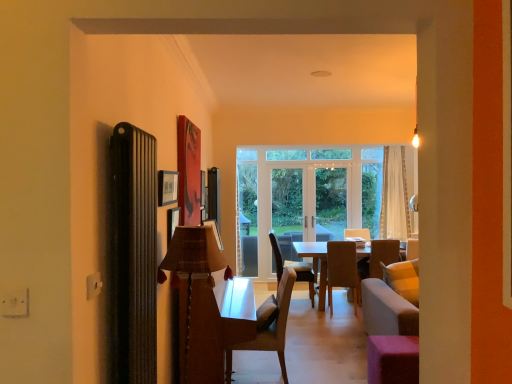
From the picture: What is the approximate height of plaid fabric lampshade at center?

plaid fabric lampshade at center is 1.09 meters tall.

The height and width of the screenshot is (384, 512). Describe the element at coordinates (293, 268) in the screenshot. I see `brown leather chair at center, which ranks as the 3th chair in front-to-back order` at that location.

In order to face pink fabric stool at lower right, should I rotate leftwards or rightwards?

It's best to rotate right around 18.785 degrees.

Measure the distance between pink fabric stool at lower right and camera.

They are 3.02 meters apart.

You are a GUI agent. You are given a task and a screenshot of the screen. Output one action in this format:
    pyautogui.click(x=<x>, y=<y>)
    Task: Click on the plaid fabric lampshade at center
    This screenshot has height=384, width=512.
    Given the screenshot: What is the action you would take?
    pyautogui.click(x=192, y=262)

Between light brown fabric chair at center, which ranks as the 2th chair in front-to-back order, and matte black picture frame at upper left, which one is positioned behind?

light brown fabric chair at center, which ranks as the 2th chair in front-to-back order.

This screenshot has width=512, height=384. What are the coordinates of `picture frame above the light brown fabric chair at center, the 1th chair in the right-to-left sequence (from a real-world perspective)` in the screenshot? It's located at (167, 187).

From the picture: Is light brown fabric chair at center, the 1th chair in the right-to-left sequence, bigger than matte black picture frame at upper left?

Correct, light brown fabric chair at center, the 1th chair in the right-to-left sequence, is larger in size than matte black picture frame at upper left.

How far apart are light brown fabric chair at center, the 1th chair in the right-to-left sequence, and matte black picture frame at upper left?

light brown fabric chair at center, the 1th chair in the right-to-left sequence, is 4.03 meters away from matte black picture frame at upper left.

Considering the relative sizes of clear glass door at center, arranged as the 1th screen door when viewed from the right, and light brown fabric chair at center, which ranks as the 2th chair in front-to-back order, in the image provided, is clear glass door at center, arranged as the 1th screen door when viewed from the right, smaller than light brown fabric chair at center, which ranks as the 2th chair in front-to-back order,?

Actually, clear glass door at center, arranged as the 1th screen door when viewed from the right, might be larger than light brown fabric chair at center, which ranks as the 2th chair in front-to-back order.

From the image's perspective, is clear glass door at center, the second screen door when ordered from left to right, under light brown fabric chair at center, the 1th chair in the right-to-left sequence?

Incorrect, from the image's perspective, clear glass door at center, the second screen door when ordered from left to right, is higher than light brown fabric chair at center, the 1th chair in the right-to-left sequence.

Considering the relative sizes of clear glass door at center, arranged as the 1th screen door when viewed from the right, and light brown fabric chair at center, the 1th chair in the right-to-left sequence, in the image provided, is clear glass door at center, arranged as the 1th screen door when viewed from the right, thinner than light brown fabric chair at center, the 1th chair in the right-to-left sequence,?

Indeed, clear glass door at center, arranged as the 1th screen door when viewed from the right, has a lesser width compared to light brown fabric chair at center, the 1th chair in the right-to-left sequence.

Does clear glass door at center, arranged as the 1th screen door when viewed from the right, contain light brown fabric chair at center, which ranks as the 2th chair in front-to-back order?

Definitely not — light brown fabric chair at center, which ranks as the 2th chair in front-to-back order, is not inside clear glass door at center, arranged as the 1th screen door when viewed from the right.

Relative to brown leather chair at center, arranged as the 1th chair when viewed from the back, is white glossy screen door at center, positioned as the first screen door in left-to-right order, in front or behind?

Clearly, white glossy screen door at center, positioned as the first screen door in left-to-right order, is behind brown leather chair at center, arranged as the 1th chair when viewed from the back.

Does white glossy screen door at center, positioned as the first screen door in left-to-right order, have a lesser width compared to brown leather chair at center, positioned as the second chair in left-to-right order?

Yes.

Is point (272, 227) closer to viewer compared to point (300, 263)?

No.

Is white glossy screen door at center, the 2th screen door viewed from the right, facing towards brown leather chair at center, which ranks as the 3th chair in front-to-back order?

Yes, white glossy screen door at center, the 2th screen door viewed from the right, is turned towards brown leather chair at center, which ranks as the 3th chair in front-to-back order.

Is light brown wooden chair at center, which appears as the 3th chair when viewed from the back, positioned beyond the bounds of pink fabric stool at lower right?

Yes, light brown wooden chair at center, which appears as the 3th chair when viewed from the back, is located beyond the bounds of pink fabric stool at lower right.

From the image's perspective, is light brown wooden chair at center, positioned as the 1th chair in left-to-right order, located above or below pink fabric stool at lower right?

From the image's perspective, light brown wooden chair at center, positioned as the 1th chair in left-to-right order, appears above pink fabric stool at lower right.

Who is bigger, light brown wooden chair at center, which is the 3th chair from right to left, or pink fabric stool at lower right?

Bigger between the two is light brown wooden chair at center, which is the 3th chair from right to left.

Can you confirm if light brown wooden chair at center, which is the 3th chair from right to left, is thinner than pink fabric stool at lower right?

In fact, light brown wooden chair at center, which is the 3th chair from right to left, might be wider than pink fabric stool at lower right.

Which is more to the left, pink fabric stool at lower right or clear glass door at center, the second screen door when ordered from left to right?

Positioned to the left is clear glass door at center, the second screen door when ordered from left to right.

Is pink fabric stool at lower right aimed at clear glass door at center, the second screen door when ordered from left to right?

No, pink fabric stool at lower right is not aimed at clear glass door at center, the second screen door when ordered from left to right.

Considering the sizes of pink fabric stool at lower right and clear glass door at center, arranged as the 1th screen door when viewed from the right, in the image, is pink fabric stool at lower right wider or thinner than clear glass door at center, arranged as the 1th screen door when viewed from the right,?

Considering their sizes, pink fabric stool at lower right looks broader than clear glass door at center, arranged as the 1th screen door when viewed from the right.

Which is in front, white sheer curtain at center or clear glass door at center, arranged as the 1th screen door when viewed from the right?

Positioned in front is white sheer curtain at center.

From a real-world perspective, count 1st screen doors downward from the white sheer curtain at center and point to it. Please provide its 2D coordinates.

[(307, 204)]

Is white sheer curtain at center taller than clear glass door at center, the second screen door when ordered from left to right?

Incorrect, the height of white sheer curtain at center is not larger of that of clear glass door at center, the second screen door when ordered from left to right.

How many degrees apart are the facing directions of white sheer curtain at center and clear glass door at center, arranged as the 1th screen door when viewed from the right?

white sheer curtain at center and clear glass door at center, arranged as the 1th screen door when viewed from the right, are facing 0.597 degrees away from each other.

Which object is positioned more to the left, clear glass door at center, arranged as the 1th screen door when viewed from the right, or brown leather chair at center, which ranks as the 3th chair in front-to-back order?

brown leather chair at center, which ranks as the 3th chair in front-to-back order.

Is clear glass door at center, the second screen door when ordered from left to right, with brown leather chair at center, which ranks as the 3th chair in front-to-back order?

A: They are not placed beside each other.

Locate an element on the screen. The width and height of the screenshot is (512, 384). the 1st chair in front when counting from the clear glass door at center, the second screen door when ordered from left to right is located at coordinates (293, 268).

From the image's perspective, who appears lower, clear glass door at center, the second screen door when ordered from left to right, or brown leather chair at center, arranged as the 1th chair when viewed from the back?

From the image's view, brown leather chair at center, arranged as the 1th chair when viewed from the back, is below.

I want to click on picture frame that is in front of the light brown fabric chair at center, the 3th chair in the left-to-right sequence, so click(167, 187).

Find the location of a particular element. chair on the right side of clear glass door at center, the second screen door when ordered from left to right is located at coordinates (342, 270).

When comparing their distances from plaid fabric lampshade at center, does light brown fabric chair at center, arranged as the 2th chair when viewed from the back, or matte black picture frame at upper left seem further?

The object further to plaid fabric lampshade at center is light brown fabric chair at center, arranged as the 2th chair when viewed from the back.

Based on their spatial positions, is pink fabric stool at lower right or plaid fabric lampshade at center closer to matte black picture frame at upper left?

plaid fabric lampshade at center.

Estimate the real-world distances between objects in this image. Which object is further from white sheer curtain at center, pink fabric stool at lower right or plaid fabric lampshade at center?

plaid fabric lampshade at center is further to white sheer curtain at center.

Looking at the image, which one is located further to plaid fabric lampshade at center, pink fabric stool at lower right or clear glass door at center, the second screen door when ordered from left to right?

clear glass door at center, the second screen door when ordered from left to right, is further to plaid fabric lampshade at center.

Which object lies further to the anchor point clear glass door at center, arranged as the 1th screen door when viewed from the right, plaid fabric lampshade at center or brown leather chair at center, which is the second chair in right-to-left order?

plaid fabric lampshade at center is further to clear glass door at center, arranged as the 1th screen door when viewed from the right.

Considering their positions, is plaid fabric lampshade at center positioned closer to matte black picture frame at upper left than brown leather chair at center, positioned as the second chair in left-to-right order?

The object closer to matte black picture frame at upper left is plaid fabric lampshade at center.

When comparing their distances from light brown fabric chair at center, which ranks as the 2th chair in front-to-back order, does white sheer curtain at center or white glossy screen door at center, the 2th screen door viewed from the right, seem further?

white glossy screen door at center, the 2th screen door viewed from the right, is further to light brown fabric chair at center, which ranks as the 2th chair in front-to-back order.

Which object lies further to the anchor point white sheer curtain at center, plaid fabric lampshade at center or pink fabric stool at lower right?

The object further to white sheer curtain at center is plaid fabric lampshade at center.

Image resolution: width=512 pixels, height=384 pixels. I want to click on chair located between plaid fabric lampshade at center and light brown fabric chair at center, the 3th chair in the left-to-right sequence, in the depth direction, so click(270, 328).

Where is `chair situated between brown leather chair at center, which is the second chair in right-to-left order, and white sheer curtain at center from left to right`? This screenshot has height=384, width=512. chair situated between brown leather chair at center, which is the second chair in right-to-left order, and white sheer curtain at center from left to right is located at coordinates (342, 270).

What are the coordinates of `screen door between plaid fabric lampshade at center and white glossy screen door at center, the 2th screen door viewed from the right, along the z-axis` in the screenshot? It's located at (307, 204).

Locate an element on the screen. This screenshot has width=512, height=384. curtain located between pink fabric stool at lower right and white glossy screen door at center, positioned as the first screen door in left-to-right order, in the depth direction is located at coordinates [395, 196].